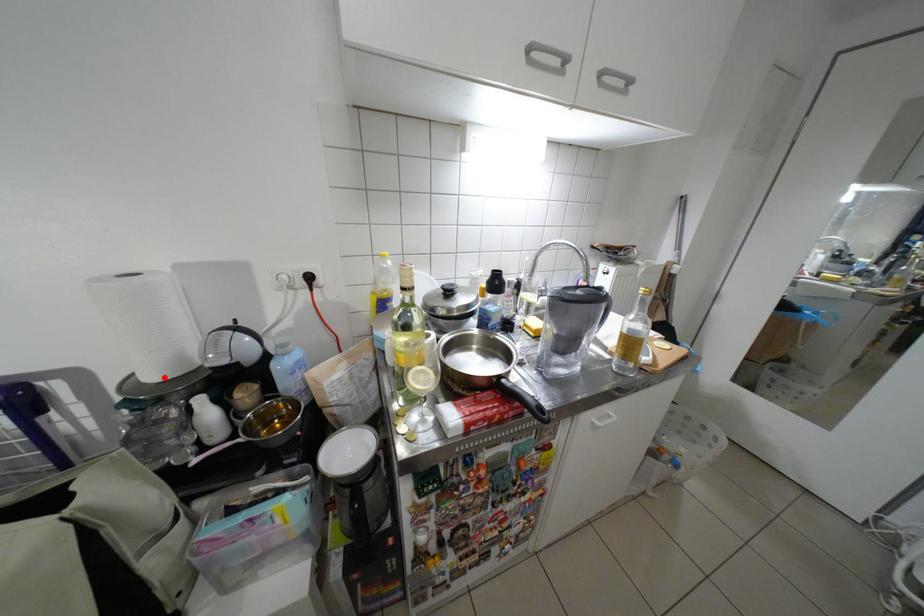
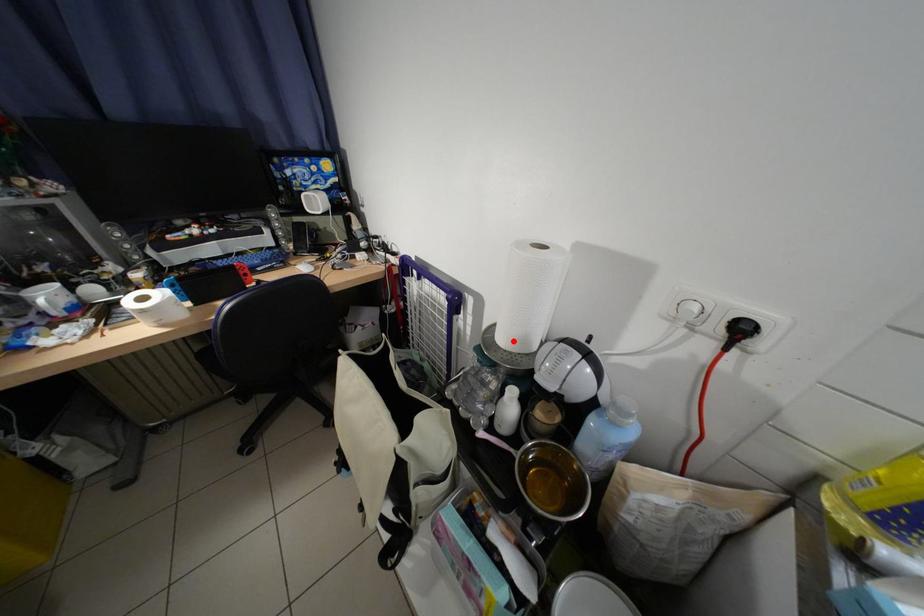
I am providing you with two images of the same scene from different viewpoints. A red point is marked on the first image and another point is marked on the second image. Is the red point in image1 aligned with the point shown in image2?

Yes